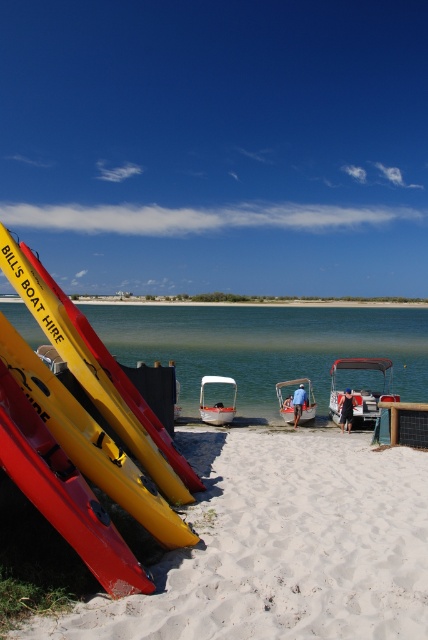
You are a photographer standing on the beach and want to take a photo of the metallic silver boat at center without the green smooth water at center blocking the view. Is this possible given their positions?

The metallic silver boat at center is behind the green smooth water at center, so it would be blocked from view. You cannot take a clear photo of the metallic silver boat at center without the green smooth water at center obstructing it.

You are standing on the white sandy beach at lower left and want to get to the metallic silver boat at center. Which direction should you head towards?

You should head towards the right because the white sandy beach at lower left is to the left of the metallic silver boat at center, so moving right will take you towards the boat.

You are standing on the beach and want to take a photo of the green smooth water at center. Where should you position yourself to capture the water in the center of your camera frame?

Position yourself directly in front of the green smooth water at center, as its 2D coordinates are at point (x=264, y=344), which is the center of the image. Align your camera to focus on that point to capture the water in the center of your frame.